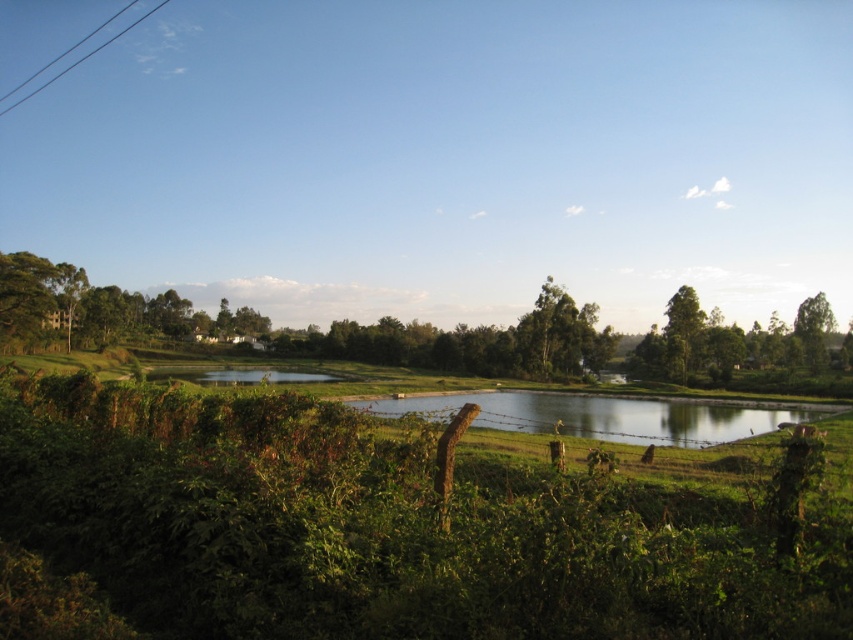
You are a landscape architect designing a new garden. You want to place a decorative stone statue exactly at the center of the image. However, you must ensure that the statue does not block the view of the green leafy shrubs at center. Given their position, where should you place the statue to avoid blocking the shrubs?

The green leafy shrubs at center are located at point [381,529]. To avoid blocking their view, the statue should be placed away from this coordinate, perhaps slightly to the left or right of the center point.